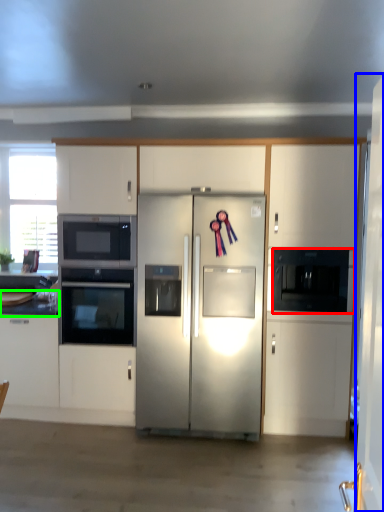
Question: Which object is the farthest from microwave oven (highlighted by a red box)? Choose among these: door (highlighted by a blue box) or countertop (highlighted by a green box).

Choices:
 (A) door
 (B) countertop

Answer: (B)